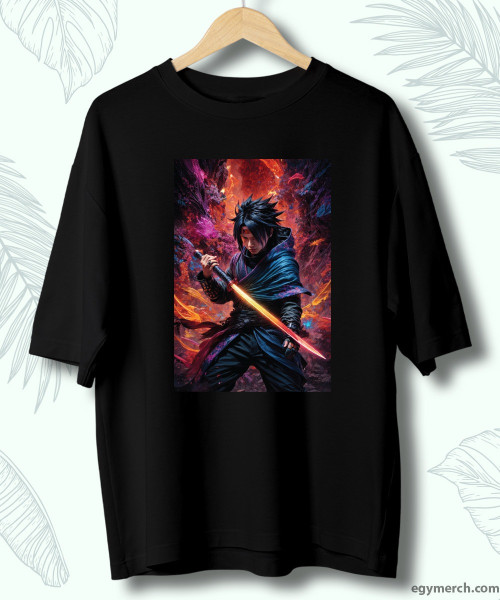
This screenshot has height=600, width=500. Find the location of `shirt hanger`. shirt hanger is located at coordinates tap(219, 25).